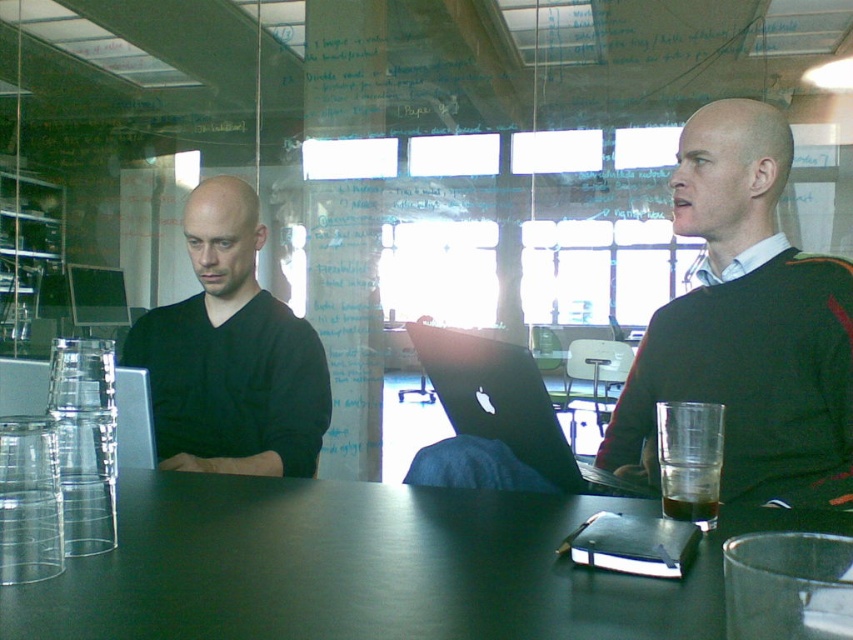
Is black matte sweater at center thinner than matte black laptop at left?

Correct, black matte sweater at center's width is less than matte black laptop at left's.

Who is lower down, black matte sweater at center or matte black laptop at left?

Positioned lower is matte black laptop at left.

Between point (744, 401) and point (233, 458), which one is positioned behind?

Point (233, 458)

This screenshot has width=853, height=640. I want to click on black matte sweater at center, so click(x=747, y=324).

Is point (784, 371) less distant than point (469, 346)?

No, (784, 371) is behind (469, 346).

Who is more distant from viewer, (x=695, y=372) or (x=515, y=424)?

Point (x=695, y=372)

Image resolution: width=853 pixels, height=640 pixels. Find the location of `black matte sweater at center`. black matte sweater at center is located at coordinates (747, 324).

Is black matte table at center bigger than matte black laptop at left?

No, black matte table at center is not bigger than matte black laptop at left.

Consider the image. Who is higher up, black matte table at center or matte black laptop at left?

matte black laptop at left is higher up.

Is point (514, 508) positioned before point (242, 275)?

That is True.

You are a GUI agent. You are given a task and a screenshot of the screen. Output one action in this format:
    pyautogui.click(x=<x>, y=<y>)
    Task: Click on the black matte table at center
    This screenshot has width=853, height=640.
    Given the screenshot: What is the action you would take?
    pyautogui.click(x=368, y=566)